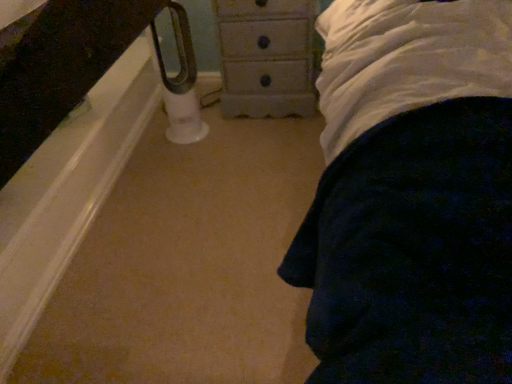
In order to click on vacant area in front of white painted wood chest of drawers at center in this screenshot , I will do [262, 148].